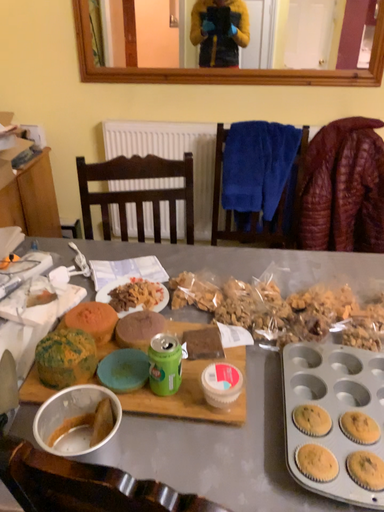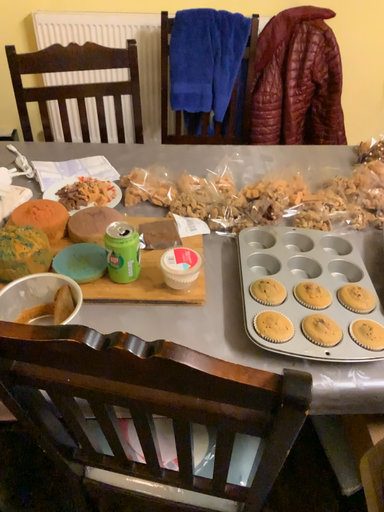
Question: How did the camera likely rotate when shooting the video?

Choices:
 (A) rotated upward
 (B) rotated downward

Answer: (B)